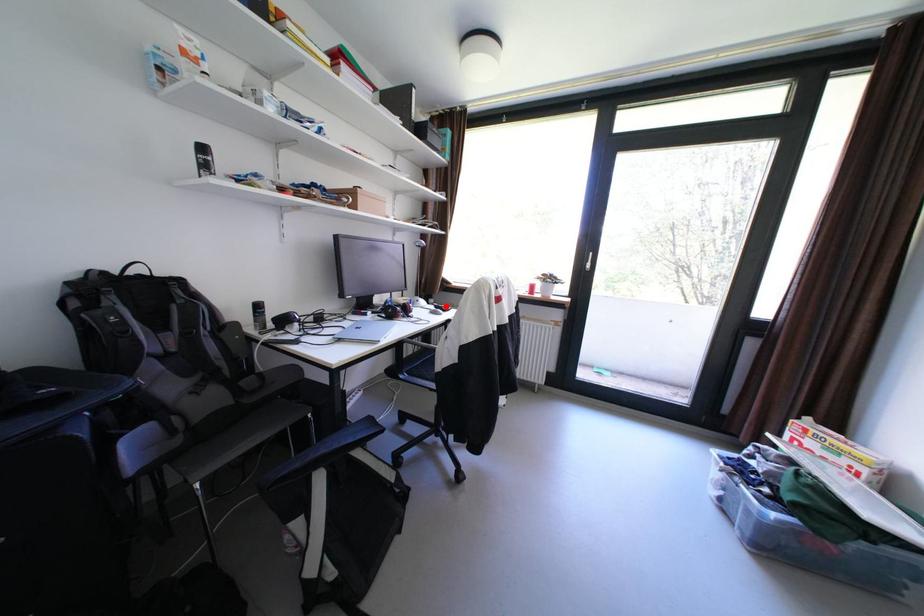
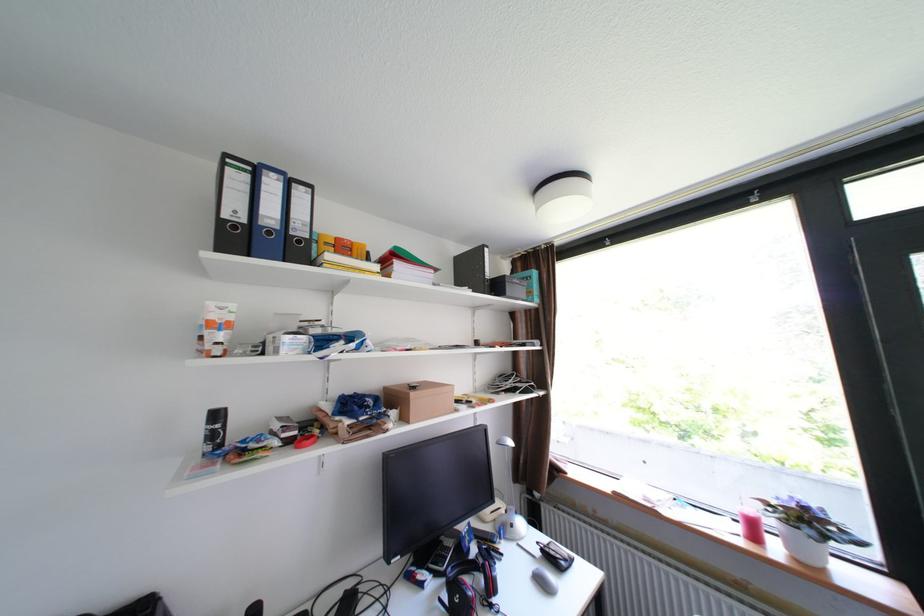
Question: I am providing you with two images of the same scene from different viewpoints. Image1 has a red point marked. In image2, the corresponding 3D location appears at what relative position? Reply with the corresponding letter.

Choices:
 (A) Closer
 (B) Farther

Answer: (A)